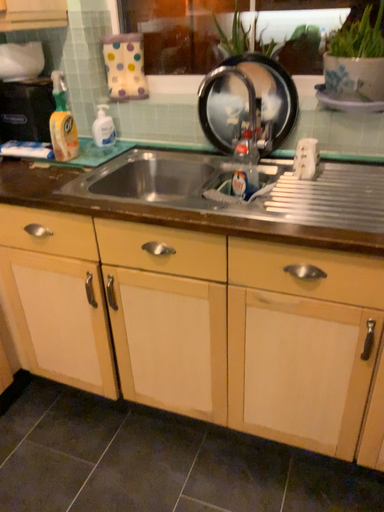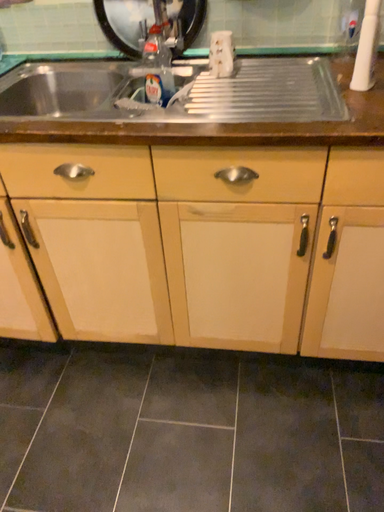
Question: How did the camera likely rotate when shooting the video?

Choices:
 (A) rotated right
 (B) rotated left

Answer: (A)